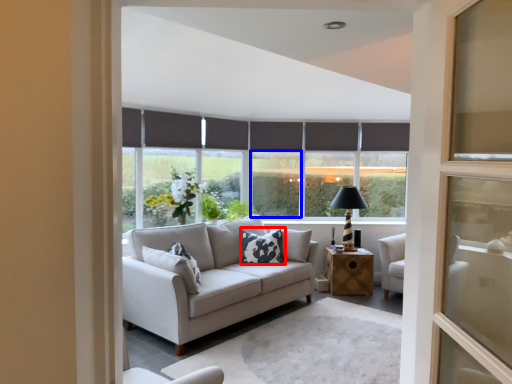
Question: Among these objects, which one is farthest to the camera, pillow (highlighted by a red box) or window (highlighted by a blue box)?

Choices:
 (A) pillow
 (B) window

Answer: (B)